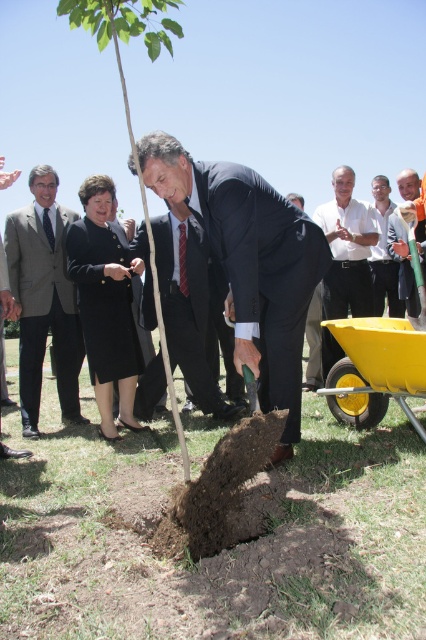
Can you confirm if dark blue suit at center is wider than light blue shirt at center?

Yes.

Is dark blue suit at center further to the viewer compared to light blue shirt at center?

No, dark blue suit at center is in front of light blue shirt at center.

I want to click on dark blue suit at center, so click(x=250, y=264).

I want to click on dark blue suit at center, so click(x=250, y=264).

Is dark blue suit at center further to camera compared to light brown wooden shovel at center?

No.

What do you see at coordinates (250, 264) in the screenshot?
I see `dark blue suit at center` at bounding box center [250, 264].

The image size is (426, 640). I want to click on dark blue suit at center, so click(250, 264).

Can you confirm if yellow plastic wagon at lower right is positioned to the left of light brown wooden shovel at center?

Correct, you'll find yellow plastic wagon at lower right to the left of light brown wooden shovel at center.

Is yellow plastic wagon at lower right thinner than light brown wooden shovel at center?

No.

Is point (370, 365) positioned before point (420, 240)?

Yes.

Identify the location of yellow plastic wagon at lower right. The width and height of the screenshot is (426, 640). (374, 371).